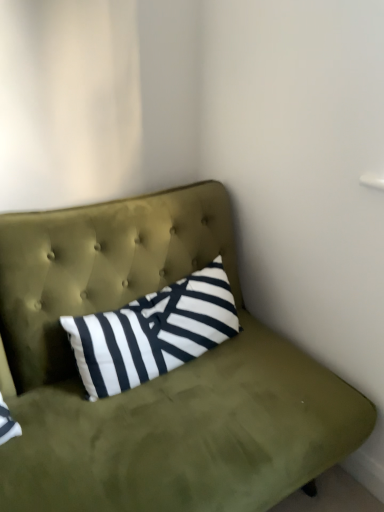
Describe the element at coordinates (153, 332) in the screenshot. I see `black and white striped pillow at center` at that location.

I want to click on black and white striped pillow at center, so click(153, 332).

In order to face black and white striped pillow at center, should I rotate leftwards or rightwards?

You should look left and rotate roughly 4.033 degrees.

What is the approximate width of olive green fabric studio couch at upper center?

olive green fabric studio couch at upper center is 32.43 inches in width.

Where is `olive green fabric studio couch at upper center`? The height and width of the screenshot is (512, 384). olive green fabric studio couch at upper center is located at coordinates (156, 378).

Image resolution: width=384 pixels, height=512 pixels. What do you see at coordinates (156, 378) in the screenshot?
I see `olive green fabric studio couch at upper center` at bounding box center [156, 378].

The width and height of the screenshot is (384, 512). Identify the location of black and white striped pillow at center. (153, 332).

Is olive green fabric studio couch at upper center at the left side of black and white striped pillow at center?

Yes, olive green fabric studio couch at upper center is to the left of black and white striped pillow at center.

Which is in front, olive green fabric studio couch at upper center or black and white striped pillow at center?

Positioned in front is olive green fabric studio couch at upper center.

Does point (112, 488) come in front of point (183, 300)?

Yes, point (112, 488) is in front of point (183, 300).

From the image's perspective, does olive green fabric studio couch at upper center appear lower than black and white striped pillow at center?

Indeed, from the image's perspective, olive green fabric studio couch at upper center is shown beneath black and white striped pillow at center.

From a real-world perspective, is olive green fabric studio couch at upper center over black and white striped pillow at center?

Incorrect, from a real-world perspective, olive green fabric studio couch at upper center is lower than black and white striped pillow at center.

Between olive green fabric studio couch at upper center and black and white striped pillow at center, which one has larger width?

With larger width is olive green fabric studio couch at upper center.

From the picture: In terms of height, does olive green fabric studio couch at upper center look taller or shorter compared to black and white striped pillow at center?

In the image, olive green fabric studio couch at upper center appears to be taller than black and white striped pillow at center.

Between olive green fabric studio couch at upper center and black and white striped pillow at center, which one has smaller size?

black and white striped pillow at center.

Is olive green fabric studio couch at upper center completely or partially outside of black and white striped pillow at center?

Absolutely, olive green fabric studio couch at upper center is external to black and white striped pillow at center.

Are olive green fabric studio couch at upper center and black and white striped pillow at center beside each other?

There is a gap between olive green fabric studio couch at upper center and black and white striped pillow at center.

Could you tell me if olive green fabric studio couch at upper center is turned towards black and white striped pillow at center?

Yes, olive green fabric studio couch at upper center is facing black and white striped pillow at center.

Measure the distance between olive green fabric studio couch at upper center and black and white striped pillow at center.

olive green fabric studio couch at upper center is 5.54 inches from black and white striped pillow at center.

The width and height of the screenshot is (384, 512). What are the coordinates of `studio couch below the black and white striped pillow at center (from the image's perspective)` in the screenshot? It's located at (156, 378).

Is black and white striped pillow at center at the right side of olive green fabric studio couch at upper center?

Yes, black and white striped pillow at center is to the right of olive green fabric studio couch at upper center.

Which object is further away from the camera, black and white striped pillow at center or olive green fabric studio couch at upper center?

black and white striped pillow at center is further away from the camera.

Which point is more distant from viewer, [60,317] or [300,368]?

The point [300,368] is farther.

From the image's perspective, between black and white striped pillow at center and olive green fabric studio couch at upper center, which one is located above?

black and white striped pillow at center.

From a real-world perspective, between black and white striped pillow at center and olive green fabric studio couch at upper center, who is vertically lower?

olive green fabric studio couch at upper center, from a real-world perspective.

Does black and white striped pillow at center have a lesser width compared to olive green fabric studio couch at upper center?

Indeed, black and white striped pillow at center has a lesser width compared to olive green fabric studio couch at upper center.

Is black and white striped pillow at center taller than olive green fabric studio couch at upper center?

In fact, black and white striped pillow at center may be shorter than olive green fabric studio couch at upper center.

Looking at this image, considering the relative sizes of black and white striped pillow at center and olive green fabric studio couch at upper center in the image provided, is black and white striped pillow at center smaller than olive green fabric studio couch at upper center?

Correct, black and white striped pillow at center occupies less space than olive green fabric studio couch at upper center.

In the scene shown: Is olive green fabric studio couch at upper center located within black and white striped pillow at center?

Definitely not — olive green fabric studio couch at upper center is not inside black and white striped pillow at center.

Is black and white striped pillow at center far from olive green fabric studio couch at upper center?

No.

Is black and white striped pillow at center facing away from olive green fabric studio couch at upper center?

Yes, black and white striped pillow at center is facing away from olive green fabric studio couch at upper center.

Can you tell me how much black and white striped pillow at center and olive green fabric studio couch at upper center differ in facing direction?

The facing directions of black and white striped pillow at center and olive green fabric studio couch at upper center are 1.66 degrees apart.

How distant is black and white striped pillow at center from olive green fabric studio couch at upper center?

They are 5.54 inches apart.

Locate an element on the screen. pillow behind the olive green fabric studio couch at upper center is located at coordinates (153, 332).

This screenshot has width=384, height=512. I want to click on pillow located above the olive green fabric studio couch at upper center (from the image's perspective), so click(153, 332).

Find the location of a particular element. This screenshot has height=512, width=384. studio couch located in front of the black and white striped pillow at center is located at coordinates (156, 378).